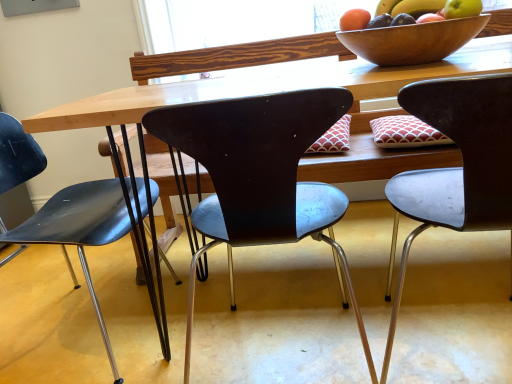
Question: Would you say matte black chair at center, which is the first chair from left to right, is part of metallic gray chair at right, which appears as the third chair when viewed from the left,'s contents?

Choices:
 (A) no
 (B) yes

Answer: (A)

Question: Is metallic gray chair at right, which is the 1th chair in right-to-left order, not close to matte black chair at center, which is the first chair from left to right?

Choices:
 (A) yes
 (B) no

Answer: (B)

Question: Does metallic gray chair at right, which is the 1th chair in right-to-left order, lie in front of matte black chair at center, which is the first chair from left to right?

Choices:
 (A) no
 (B) yes

Answer: (B)

Question: Is metallic gray chair at right, which appears as the third chair when viewed from the left, positioned behind matte black chair at center, which is counted as the 3th chair, starting from the right?

Choices:
 (A) no
 (B) yes

Answer: (A)

Question: Considering the relative sizes of metallic gray chair at right, which is the 1th chair in right-to-left order, and matte black chair at center, which is the first chair from left to right, in the image provided, is metallic gray chair at right, which is the 1th chair in right-to-left order, bigger than matte black chair at center, which is the first chair from left to right,?

Choices:
 (A) no
 (B) yes

Answer: (A)

Question: From the image's perspective, is wooden bowl at upper right above or below metallic gray chair at right, which is the 1th chair in right-to-left order?

Choices:
 (A) below
 (B) above

Answer: (B)

Question: From a real-world perspective, is wooden bowl at upper right physically located above or below metallic gray chair at right, which appears as the third chair when viewed from the left?

Choices:
 (A) below
 (B) above

Answer: (B)

Question: Considering the positions of wooden bowl at upper right and metallic gray chair at right, which is the 1th chair in right-to-left order, in the image, is wooden bowl at upper right bigger or smaller than metallic gray chair at right, which is the 1th chair in right-to-left order,?

Choices:
 (A) big
 (B) small

Answer: (B)

Question: Which is correct: wooden bowl at upper right is inside metallic gray chair at right, which appears as the third chair when viewed from the left, or outside of it?

Choices:
 (A) outside
 (B) inside

Answer: (A)

Question: In the image, is matte black chair at center, which is the second chair in left-to-right order, on the left side or the right side of metallic gray chair at right, which is the 1th chair in right-to-left order?

Choices:
 (A) right
 (B) left

Answer: (B)

Question: Considering the positions of matte black chair at center, which is the second chair in left-to-right order, and metallic gray chair at right, which is the 1th chair in right-to-left order, in the image, is matte black chair at center, which is the second chair in left-to-right order, taller or shorter than metallic gray chair at right, which is the 1th chair in right-to-left order,?

Choices:
 (A) tall
 (B) short

Answer: (A)

Question: Relative to metallic gray chair at right, which is the 1th chair in right-to-left order, is matte black chair at center, the second chair positioned from the right, in front or behind?

Choices:
 (A) front
 (B) behind

Answer: (B)

Question: Is matte black chair at center, the second chair positioned from the right, bigger or smaller than metallic gray chair at right, which is the 1th chair in right-to-left order?

Choices:
 (A) big
 (B) small

Answer: (A)

Question: Choose the correct answer: Is matte orange at upper right inside metallic gray chair at right, which is the 1th chair in right-to-left order, or outside it?

Choices:
 (A) outside
 (B) inside

Answer: (A)

Question: In terms of size, does matte orange at upper right appear bigger or smaller than metallic gray chair at right, which is the 1th chair in right-to-left order?

Choices:
 (A) big
 (B) small

Answer: (B)